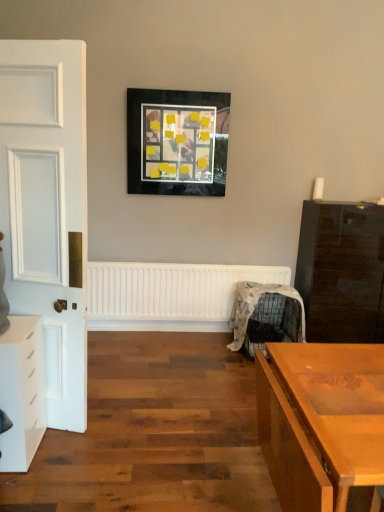
Where is `vacant space underneath white matte radiator at center (from a real-world perspective)`? vacant space underneath white matte radiator at center (from a real-world perspective) is located at coordinates 165,329.